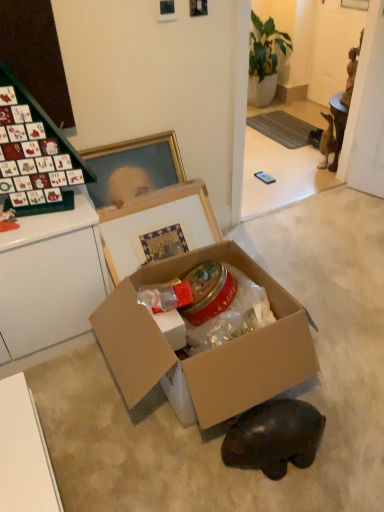
Find the location of `vacant space situated above shiny black bear at lower center, the first animal from the front (from a real-world perspective)`. vacant space situated above shiny black bear at lower center, the first animal from the front (from a real-world perspective) is located at coordinates (273, 415).